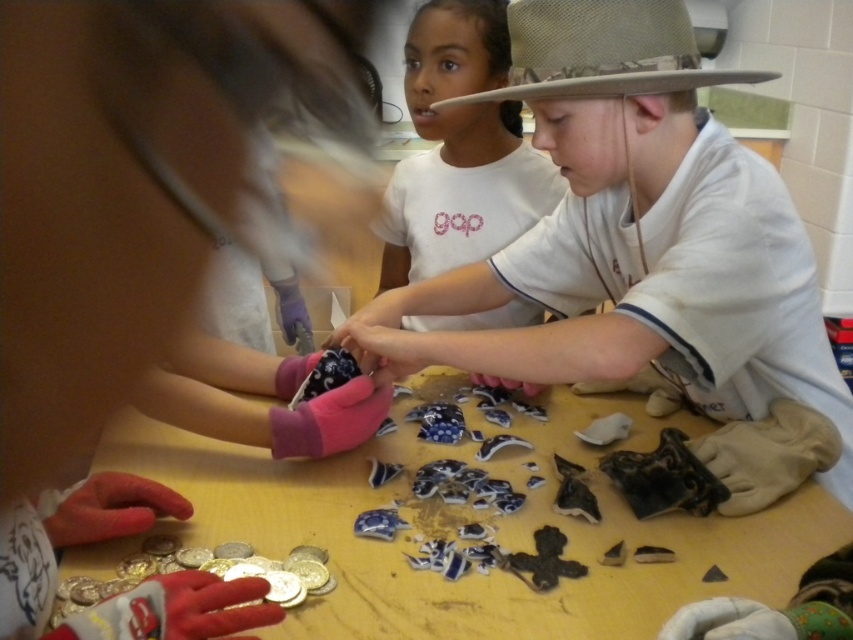
Which is behind, point (572, 202) or point (433, 225)?

The point (433, 225) is behind.

Is point (494, 259) closer to viewer compared to point (416, 236)?

Yes.

Where is `matte white shirt at center`? The image size is (853, 640). matte white shirt at center is located at coordinates (635, 240).

Can you confirm if white cotton shirt at center is taller than camouflage fabric cowboy hat at upper center?

Correct, white cotton shirt at center is much taller as camouflage fabric cowboy hat at upper center.

Based on the photo, can you confirm if white cotton shirt at center is wider than camouflage fabric cowboy hat at upper center?

Incorrect, white cotton shirt at center's width does not surpass camouflage fabric cowboy hat at upper center's.

Locate an element on the screen. The width and height of the screenshot is (853, 640). white cotton shirt at center is located at coordinates (460, 148).

Does wooden table at center appear over white cotton shirt at center?

Incorrect, wooden table at center is not positioned above white cotton shirt at center.

Describe the element at coordinates (480, 522) in the screenshot. This screenshot has height=640, width=853. I see `wooden table at center` at that location.

Identify the location of wooden table at center. The height and width of the screenshot is (640, 853). (480, 522).